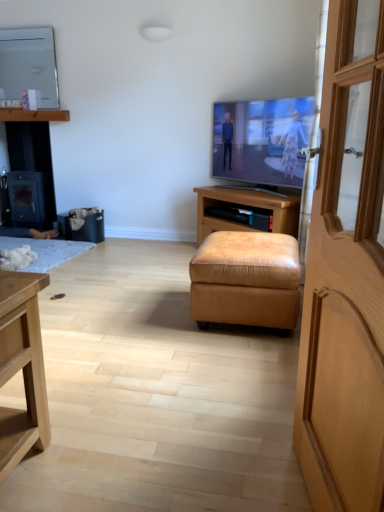
Question: Is matte white mirror at upper left, which appears as the second television when viewed from the right, shorter than flat screen tv at center, marked as the 2th television in a top-to-bottom arrangement?

Choices:
 (A) yes
 (B) no

Answer: (B)

Question: Considering the relative sizes of matte white mirror at upper left, arranged as the second television when viewed from the front, and flat screen tv at center, placed as the first television when sorted from right to left, in the image provided, is matte white mirror at upper left, arranged as the second television when viewed from the front, thinner than flat screen tv at center, placed as the first television when sorted from right to left,?

Choices:
 (A) no
 (B) yes

Answer: (B)

Question: Does matte white mirror at upper left, which appears as the second television when viewed from the right, have a smaller size compared to flat screen tv at center, which is counted as the 1th television, starting from the front?

Choices:
 (A) no
 (B) yes

Answer: (B)

Question: Could you tell me if matte white mirror at upper left, which appears as the second television when viewed from the right, is turned towards flat screen tv at center, which ranks as the 2th television in left-to-right order?

Choices:
 (A) yes
 (B) no

Answer: (B)

Question: Is matte white mirror at upper left, which ranks as the first television in left-to-right order, far from flat screen tv at center, placed as the first television when sorted from right to left?

Choices:
 (A) yes
 (B) no

Answer: (A)

Question: Is matte white mirror at upper left, which ranks as the first television in left-to-right order, at the left side of flat screen tv at center, marked as the first television in a bottom-to-top arrangement?

Choices:
 (A) no
 (B) yes

Answer: (B)

Question: From a real-world perspective, is black leather trash bin/can at lower left on white fluffy rug at lower left?

Choices:
 (A) no
 (B) yes

Answer: (B)

Question: Does black leather trash bin/can at lower left have a greater height compared to white fluffy rug at lower left?

Choices:
 (A) yes
 (B) no

Answer: (A)

Question: Is black leather trash bin/can at lower left beside white fluffy rug at lower left?

Choices:
 (A) yes
 (B) no

Answer: (B)

Question: Is black leather trash bin/can at lower left facing away from white fluffy rug at lower left?

Choices:
 (A) no
 (B) yes

Answer: (A)

Question: Does black leather trash bin/can at lower left come behind white fluffy rug at lower left?

Choices:
 (A) no
 (B) yes

Answer: (B)

Question: Is black leather trash bin/can at lower left positioned in front of white fluffy rug at lower left?

Choices:
 (A) no
 (B) yes

Answer: (A)

Question: Considering the relative sizes of black leather trash bin/can at lower left and black matte wood fireplace at left in the image provided, is black leather trash bin/can at lower left shorter than black matte wood fireplace at left?

Choices:
 (A) no
 (B) yes

Answer: (B)